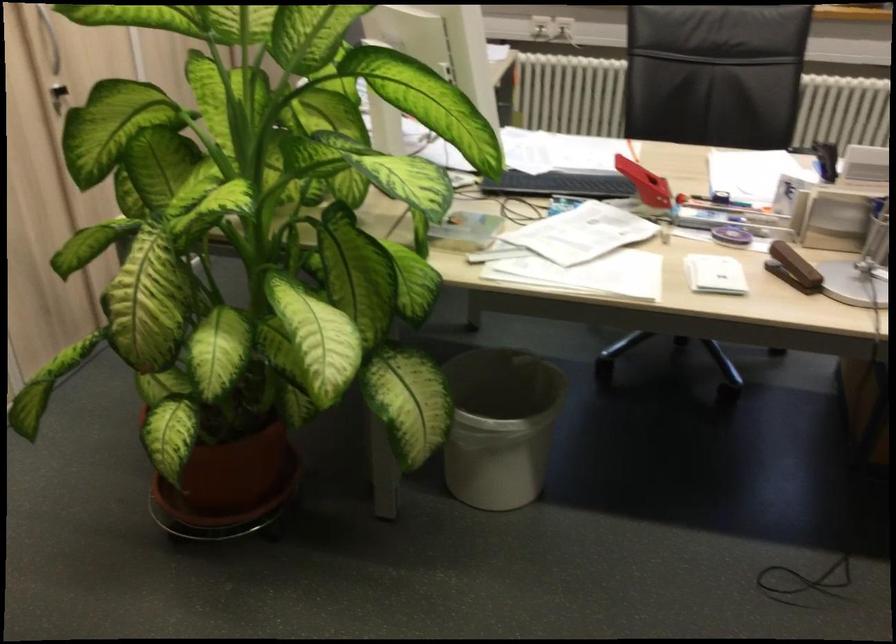
Describe the element at coordinates (57, 96) in the screenshot. I see `the black cabinet handle` at that location.